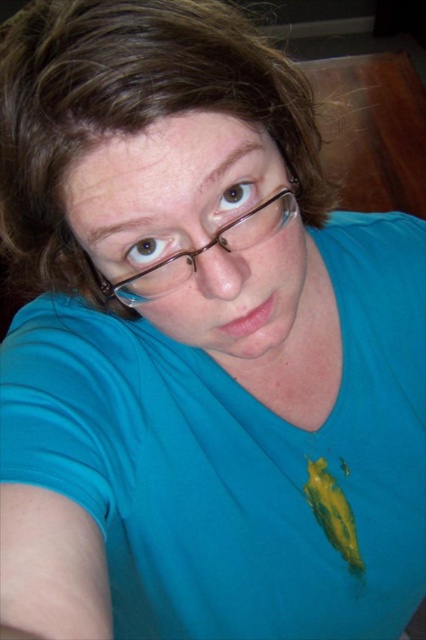
Question: Does brownhair at center have a greater width compared to clear plastic glasses at center?

Choices:
 (A) no
 (B) yes

Answer: (B)

Question: Which point is farther from the camera taking this photo?

Choices:
 (A) (81, 61)
 (B) (236, 248)

Answer: (B)

Question: Which point is closer to the camera taking this photo?

Choices:
 (A) click(x=281, y=200)
 (B) click(x=302, y=120)

Answer: (A)

Question: From the image, what is the correct spatial relationship of brownhair at center in relation to clear plastic glasses at center?

Choices:
 (A) left
 (B) right

Answer: (B)

Question: Which of the following is the farthest from the observer?

Choices:
 (A) (166, 278)
 (B) (48, 195)

Answer: (A)

Question: Is brownhair at center positioned at the back of clear plastic glasses at center?

Choices:
 (A) yes
 (B) no

Answer: (B)